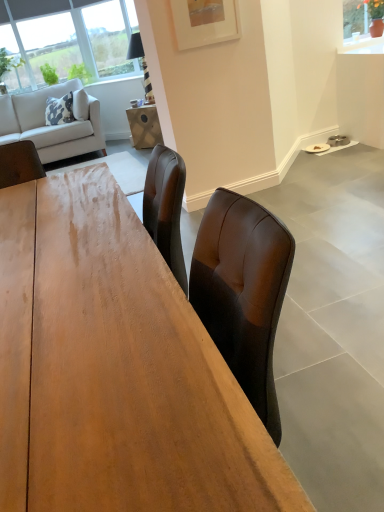
The image size is (384, 512). What do you see at coordinates (115, 369) in the screenshot? I see `wooden table at center` at bounding box center [115, 369].

You are a GUI agent. You are given a task and a screenshot of the screen. Output one action in this format:
    pyautogui.click(x=<x>, y=<y>)
    Task: Click on the white matte plate at lower right
    
    Given the screenshot: What is the action you would take?
    pyautogui.click(x=317, y=148)

Locate an element on the screen. The height and width of the screenshot is (512, 384). white glossy counter top at upper right is located at coordinates (363, 46).

Identify the location of white matte picture frame at upper center. (205, 22).

Is white glossy counter top at upper right placed right next to white matte plate at lower right?

There is a gap between white glossy counter top at upper right and white matte plate at lower right.

Considering the sizes of objects white glossy counter top at upper right and white matte plate at lower right in the image provided, who is taller, white glossy counter top at upper right or white matte plate at lower right?

Standing taller between the two is white glossy counter top at upper right.

From the image's perspective, between white glossy counter top at upper right and white matte plate at lower right, who is located below?

From the image's view, white matte plate at lower right is below.

Would you say white glossy counter top at upper right is a long distance from light gray fabric couch at upper left?

white glossy counter top at upper right is far away from light gray fabric couch at upper left.

Which object is closer to the camera, white glossy counter top at upper right or light gray fabric couch at upper left?

white glossy counter top at upper right is closer to the camera.

Considering the relative sizes of white glossy counter top at upper right and light gray fabric couch at upper left in the image provided, is white glossy counter top at upper right shorter than light gray fabric couch at upper left?

Indeed, white glossy counter top at upper right has a lesser height compared to light gray fabric couch at upper left.

From the image's perspective, which is above, white glossy counter top at upper right or light gray fabric couch at upper left?

From the image's view, white glossy counter top at upper right is above.

Could you tell me if wooden table at center is facing light gray fabric couch at upper left?

No.

From the image's perspective, which one is positioned higher, wooden table at center or light gray fabric couch at upper left?

light gray fabric couch at upper left appears higher in the image.

Would you say wooden table at center is inside or outside light gray fabric couch at upper left?

The correct answer is: outside.

From a real-world perspective, is wooden table at center located higher than light gray fabric couch at upper left?

Incorrect, from a real-world perspective, wooden table at center is lower than light gray fabric couch at upper left.

Locate an element on the screen. This screenshot has height=512, width=384. picture frame on the right of light gray fabric couch at upper left is located at coordinates (205, 22).

Is light gray fabric couch at upper left smaller than white matte picture frame at upper center?

Incorrect, light gray fabric couch at upper left is not smaller in size than white matte picture frame at upper center.

Is light gray fabric couch at upper left situated inside white matte picture frame at upper center or outside?

light gray fabric couch at upper left lies outside white matte picture frame at upper center.

From a real-world perspective, which is physically above, light gray fabric couch at upper left or white matte picture frame at upper center?

white matte picture frame at upper center.

Could you tell me if white matte plate at lower right is facing wooden table at center?

No, white matte plate at lower right is not facing towards wooden table at center.

From the picture: What's the angular difference between white matte plate at lower right and wooden table at center's facing directions?

white matte plate at lower right and wooden table at center are facing 1.27 degrees away from each other.

Is white matte plate at lower right in contact with wooden table at center?

No, white matte plate at lower right is not in contact with wooden table at center.

Considering the relative sizes of white matte plate at lower right and wooden table at center in the image provided, is white matte plate at lower right thinner than wooden table at center?

Yes.

Looking at this image, is white glossy counter top at upper right at the right side of wooden table at center?

Indeed, white glossy counter top at upper right is positioned on the right side of wooden table at center.

Is white glossy counter top at upper right far away from wooden table at center?

That's right, there is a large distance between white glossy counter top at upper right and wooden table at center.

Is wooden table at center a part of white glossy counter top at upper right?

No, wooden table at center is not a part of white glossy counter top at upper right.

Which is nearer, (357, 39) or (46, 505)?

Point (46, 505)

Is white matte plate at lower right located within wooden table at center?

No, white matte plate at lower right is not inside wooden table at center.

From the picture: Considering the sizes of objects wooden table at center and white matte plate at lower right in the image provided, who is taller, wooden table at center or white matte plate at lower right?

With more height is wooden table at center.

From a real-world perspective, which object rests below the other?

In real-world perspective, white matte plate at lower right is lower.

I want to click on counter top above the white matte plate at lower right (from the image's perspective), so click(x=363, y=46).

You are a GUI agent. You are given a task and a screenshot of the screen. Output one action in this format:
    pyautogui.click(x=<x>, y=<y>)
    Task: Click on the counter top in front of the light gray fabric couch at upper left
    This screenshot has width=384, height=512.
    Given the screenshot: What is the action you would take?
    pyautogui.click(x=363, y=46)

Estimate the real-world distances between objects in this image. Which object is closer to light gray fabric couch at upper left, white glossy counter top at upper right or white matte plate at lower right?

white matte plate at lower right lies closer to light gray fabric couch at upper left than the other object.

Estimate the real-world distances between objects in this image. Which object is closer to white matte picture frame at upper center, wooden table at center or white glossy counter top at upper right?

white glossy counter top at upper right is closer to white matte picture frame at upper center.

Considering their positions, is wooden table at center positioned closer to white glossy counter top at upper right than white matte picture frame at upper center?

Based on the image, white matte picture frame at upper center appears to be nearer to white glossy counter top at upper right.

Looking at the image, which one is located closer to white matte picture frame at upper center, wooden table at center or light gray fabric couch at upper left?

wooden table at center is positioned closer to the anchor white matte picture frame at upper center.

Looking at the image, which one is located closer to white matte picture frame at upper center, white glossy counter top at upper right or light gray fabric couch at upper left?

Based on the image, white glossy counter top at upper right appears to be nearer to white matte picture frame at upper center.

When comparing their distances from white matte picture frame at upper center, does light gray fabric couch at upper left or white glossy counter top at upper right seem further?

light gray fabric couch at upper left.

From the image, which object appears to be nearer to light gray fabric couch at upper left, white matte picture frame at upper center or wooden table at center?

The object closer to light gray fabric couch at upper left is white matte picture frame at upper center.

When comparing their distances from light gray fabric couch at upper left, does white matte picture frame at upper center or white matte plate at lower right seem closer?

white matte picture frame at upper center is positioned closer to the anchor light gray fabric couch at upper left.

At what (x,y) coordinates should I click in order to perform the action: click on plate between wooden table at center and light gray fabric couch at upper left from front to back. Please return your answer as a coordinate pair (x, y). The width and height of the screenshot is (384, 512). Looking at the image, I should click on (317, 148).

I want to click on picture frame positioned between wooden table at center and white matte plate at lower right from near to far, so tap(205, 22).

Locate an element on the screen. The width and height of the screenshot is (384, 512). picture frame situated between light gray fabric couch at upper left and white matte plate at lower right from left to right is located at coordinates (205, 22).

Where is `counter top between wooden table at center and white matte plate at lower right in the front-back direction`? counter top between wooden table at center and white matte plate at lower right in the front-back direction is located at coordinates (363, 46).